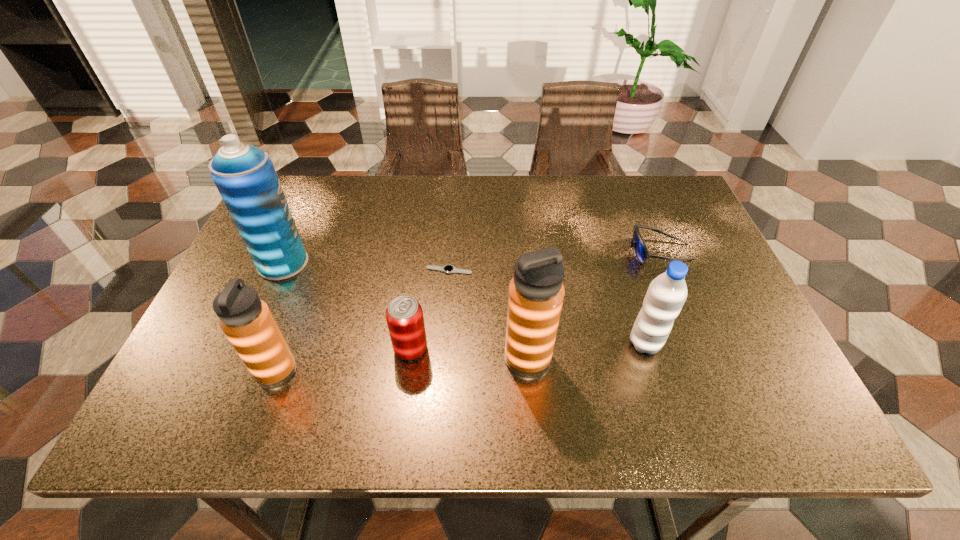
Image resolution: width=960 pixels, height=540 pixels. What are the coordinates of `free location located on the front-facing side of the sunglasses` in the screenshot? It's located at (484, 252).

What are the coordinates of `vacant region located 0.210m on the front-facing side of the sunglasses` in the screenshot? It's located at (549, 252).

I want to click on vacant area located on the front-facing side of the sunglasses, so click(x=530, y=252).

Locate an element on the screen. free space located 0.320m on the back of the aerosol can is located at coordinates (321, 178).

Where is `free space located 0.280m on the left of the shortest object`? The width and height of the screenshot is (960, 540). free space located 0.280m on the left of the shortest object is located at coordinates (314, 271).

Locate an element on the screen. vacant space located on the back of the fifth tallest object is located at coordinates (421, 268).

At what (x,y) coordinates should I click in order to perform the action: click on free region located 0.330m on the left of the water bottle. Please return your answer as a coordinate pair (x, y). Looking at the image, I should click on (475, 343).

The width and height of the screenshot is (960, 540). In order to click on can positioned at the near edge in this screenshot , I will do `click(404, 315)`.

Find the location of a particular element. The image size is (960, 540). water bottle located at the near edge is located at coordinates (666, 295).

You are a GUI agent. You are given a task and a screenshot of the screen. Output one action in this format:
    pyautogui.click(x=<x>, y=<y>)
    Task: Click on the thermos bottle present at the left edge
    The width and height of the screenshot is (960, 540).
    Given the screenshot: What is the action you would take?
    pyautogui.click(x=247, y=322)